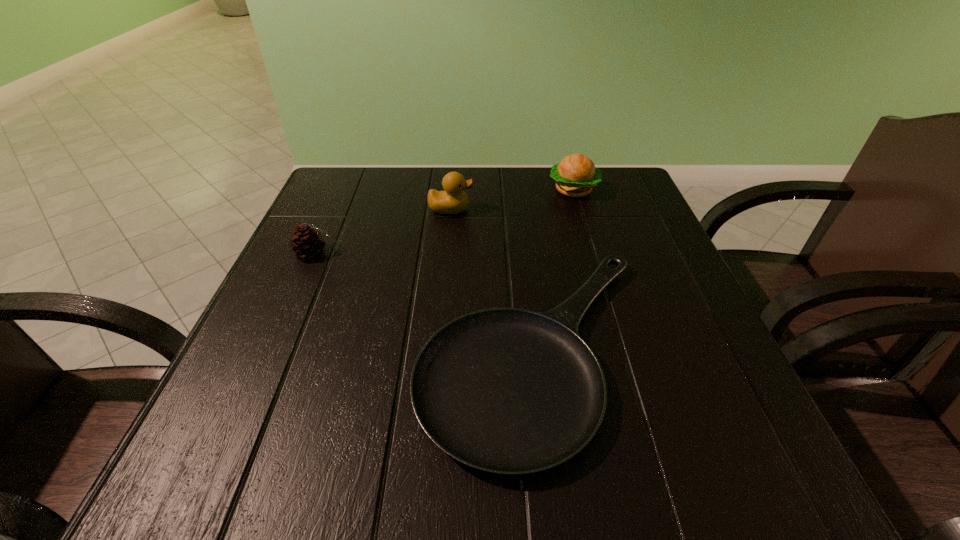
Identify the location of duckling. (453, 200).

Identify the location of hamburger. pos(576,174).

Locate an element on the screen. Image resolution: width=960 pixels, height=540 pixels. the second shortest object is located at coordinates click(x=307, y=242).

Find the location of a particular element. This screenshot has width=960, height=540. pinecone is located at coordinates (307, 242).

I want to click on frying pan, so click(x=510, y=391).

You are a GUI agent. You are given a task and a screenshot of the screen. Output one action in this format:
    pyautogui.click(x=<x>, y=<y>)
    Task: Click on the shortest object
    Image resolution: width=960 pixels, height=540 pixels.
    Given the screenshot: What is the action you would take?
    pyautogui.click(x=510, y=391)

Identify the location of vacant region located 0.320m on the face of the duckling. (609, 209).

Find the location of a particular element. free space located on the left of the hamburger is located at coordinates (479, 190).

Find the location of a particular element. vacant space situated with a leaf charm attached to the second nearest object is located at coordinates (506, 253).

Locate an element on the screen. Image resolution: width=960 pixels, height=540 pixels. free space located on the back of the nearest object is located at coordinates (522, 237).